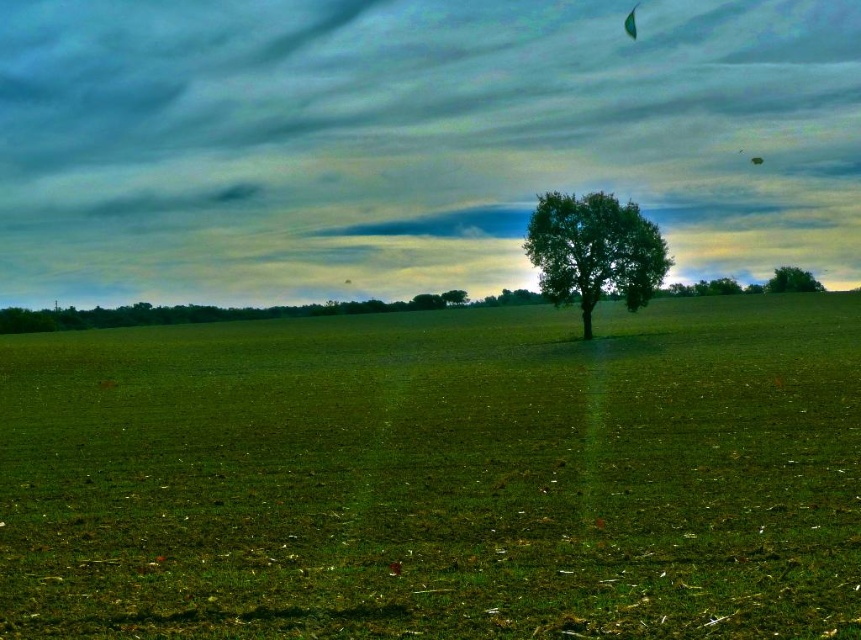
You are standing at the origin point of the image coordinate system. You want to walk to the green grassy field at center. Which direction should you go?

The green grassy field at center is located at coordinate point 0.744 on the x axis and 0.510 on the y axis. Since you are at the origin point, you should move towards the positive x and y directions to reach it.

You are standing at the point labeled as point [438,476] in the image. What do you see directly in front of you?

The point [438,476] indicates green grassy field at center, so you would see the green grassy field at center directly in front of you.